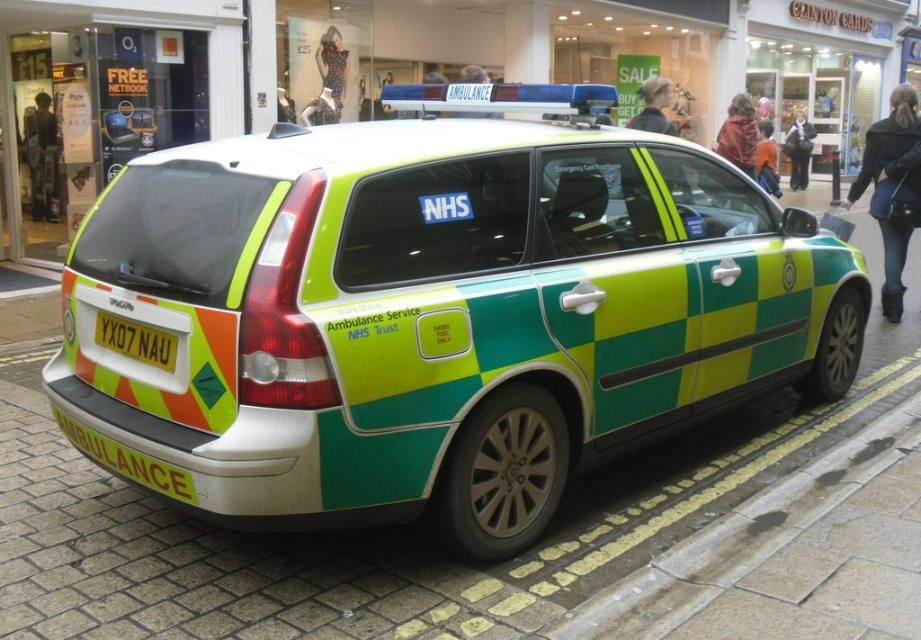
Describe the element at coordinates (435, 310) in the screenshot. This screenshot has height=640, width=921. I see `green checkered ambulance at center` at that location.

Is green checkered ambulance at center further to the viewer compared to yellow metallic license plate at rear?

No.

Is point (264, 257) closer to camera compared to point (134, 340)?

Yes, it is in front of point (134, 340).

Identify the location of green checkered ambulance at center. This screenshot has width=921, height=640. (435, 310).